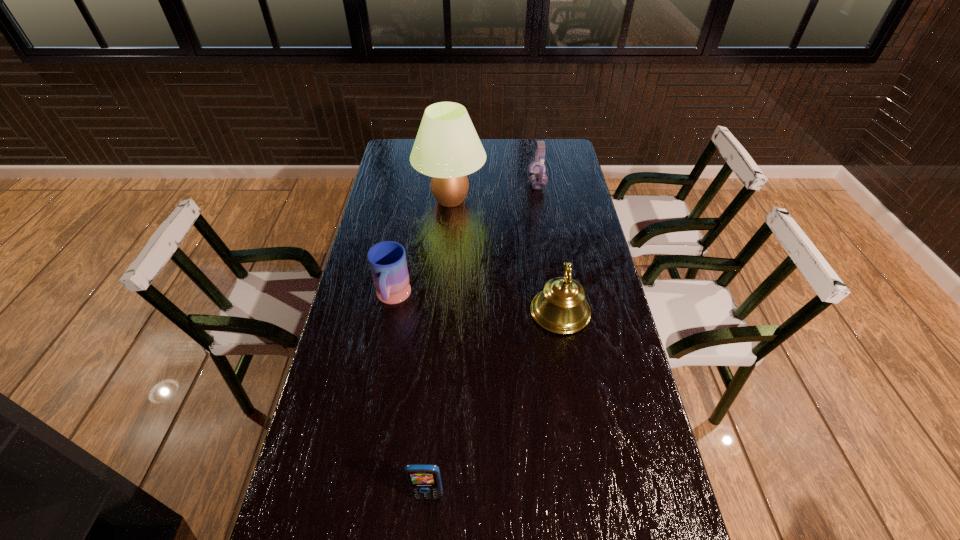
Identify the location of free point between the bell and the headset. (548, 247).

I want to click on unoccupied area between the bell and the headset, so click(548, 247).

Choose which object is the nearest neighbor to the mug. Please provide its 2D coordinates. Your answer should be formatted as a tuple, i.e. [(x, y)], where the tuple contains the x and y coordinates of a point satisfying the conditions above.

[(447, 148)]

Identify the location of the third closest object relative to the bell. This screenshot has width=960, height=540. (424, 480).

Identify the location of vacant space that satisfies the following two spatial constraints: 1. on the shade of the tallest object; 2. on the side of the mug with the handle. (443, 298).

This screenshot has width=960, height=540. Find the location of `free space that satisfies the following two spatial constraints: 1. on the shade of the bell; 2. on the left side of the lampshade`. free space that satisfies the following two spatial constraints: 1. on the shade of the bell; 2. on the left side of the lampshade is located at coordinates (442, 312).

Locate an element on the screen. free space that satisfies the following two spatial constraints: 1. on the shade of the lampshade; 2. on the side of the mug with the handle is located at coordinates (443, 298).

Locate an element on the screen. The width and height of the screenshot is (960, 540). free space in the image that satisfies the following two spatial constraints: 1. on the headband and ear cups of the headset; 2. on the left side of the bell is located at coordinates (557, 312).

This screenshot has width=960, height=540. In order to click on blank area in the image that satisfies the following two spatial constraints: 1. on the headband and ear cups of the headset; 2. on the right side of the bell in this screenshot , I will do `click(557, 312)`.

This screenshot has height=540, width=960. Find the location of `free space in the image that satisfies the following two spatial constraints: 1. on the shade of the tallest object; 2. on the screen of the nearest object`. free space in the image that satisfies the following two spatial constraints: 1. on the shade of the tallest object; 2. on the screen of the nearest object is located at coordinates tap(428, 495).